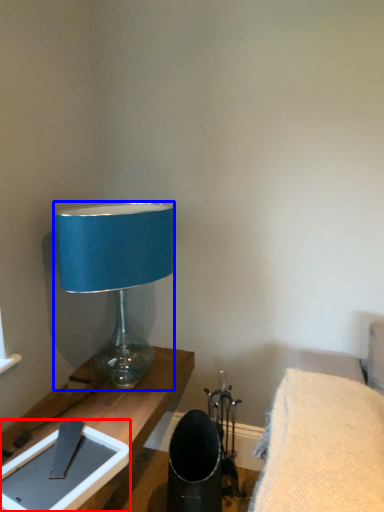
Question: Which object appears closest to the camera in this image, tablet computer (highlighted by a red box) or lamp (highlighted by a blue box)?

Choices:
 (A) tablet computer
 (B) lamp

Answer: (A)